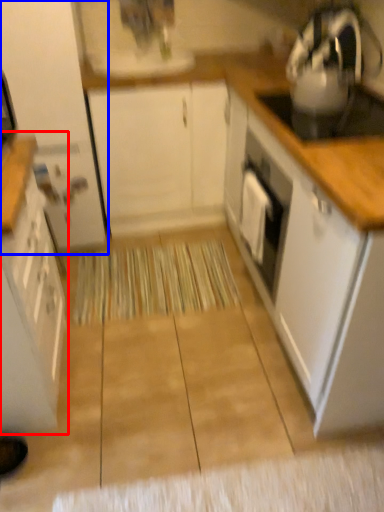
Question: Which object appears closest to the camera in this image, cabinetry (highlighted by a red box) or cabinetry (highlighted by a blue box)?

Choices:
 (A) cabinetry
 (B) cabinetry

Answer: (A)